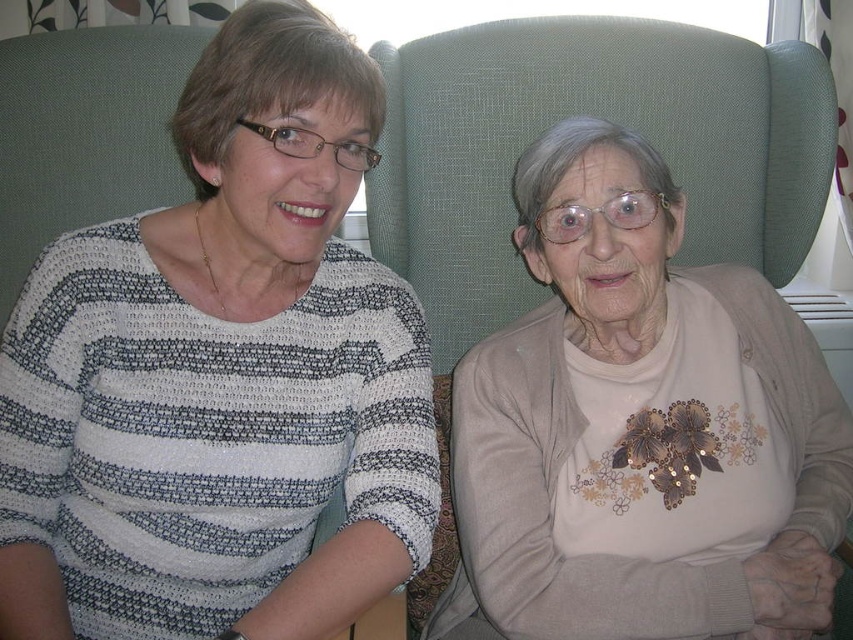
Question: Which point is farther to the camera?

Choices:
 (A) beige embroidered sweater at center
 (B) matte striped sweater at center

Answer: (A)

Question: Does matte striped sweater at center appear on the left side of beige embroidered sweater at center?

Choices:
 (A) yes
 (B) no

Answer: (A)

Question: Which of the following is the closest to the observer?

Choices:
 (A) matte striped sweater at center
 (B) beige embroidered sweater at center

Answer: (A)

Question: Does matte striped sweater at center appear on the left side of beige embroidered sweater at center?

Choices:
 (A) yes
 (B) no

Answer: (A)

Question: Which of the following is the farthest from the observer?

Choices:
 (A) beige embroidered sweater at center
 (B) matte striped sweater at center

Answer: (A)

Question: Does matte striped sweater at center appear under beige embroidered sweater at center?

Choices:
 (A) yes
 (B) no

Answer: (B)